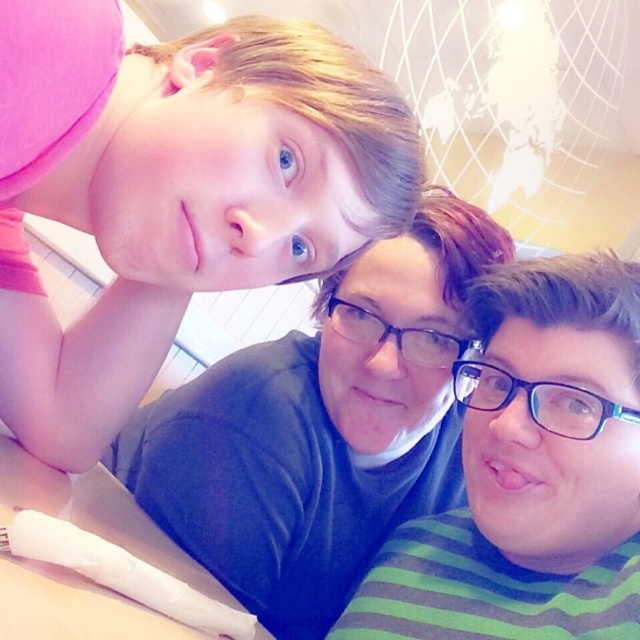
Question: Which object is closer to the camera taking this photo?

Choices:
 (A) pink matte shirt at upper left
 (B) green striped shirt at center
 (C) transparent plastic glasses at center

Answer: (A)

Question: Based on their relative distances, which object is nearer to the white plastic table at lower left?

Choices:
 (A) blue plastic glasses at center
 (B) matte black shirt at center

Answer: (B)

Question: Is matte black shirt at center thinner than blue plastic glasses at center?

Choices:
 (A) yes
 (B) no

Answer: (B)

Question: Which object is the closest to the blue plastic glasses at center?

Choices:
 (A) white plastic table at lower left
 (B) pink matte shirt at upper left

Answer: (B)

Question: Is green striped shirt at center to the left of blue plastic glasses at center from the viewer's perspective?

Choices:
 (A) yes
 (B) no

Answer: (A)

Question: Is green striped shirt at center below blue plastic glasses at center?

Choices:
 (A) no
 (B) yes

Answer: (B)